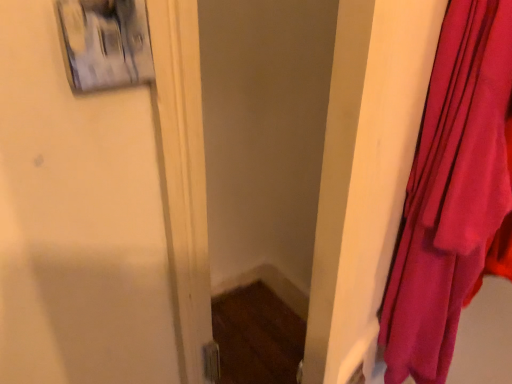
What do you see at coordinates (452, 192) in the screenshot? The width and height of the screenshot is (512, 384). I see `purple silky curtain at right` at bounding box center [452, 192].

The width and height of the screenshot is (512, 384). I want to click on purple silky curtain at right, so click(452, 192).

Where is `purple silky curtain at right`? This screenshot has height=384, width=512. purple silky curtain at right is located at coordinates (452, 192).